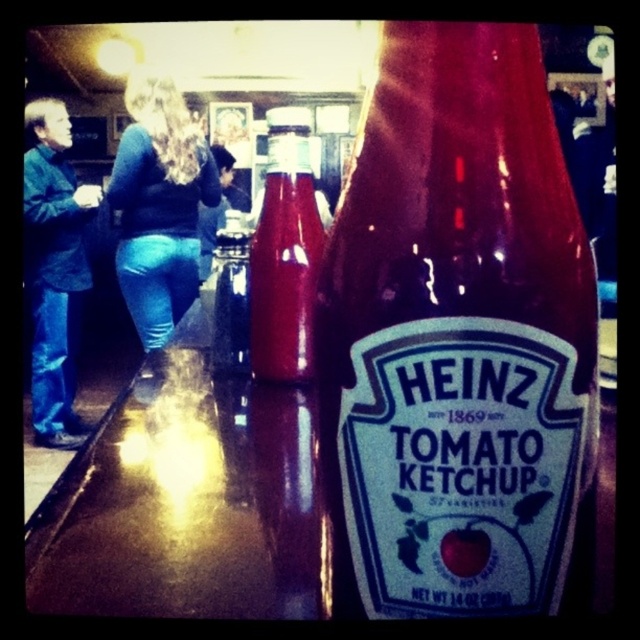
Who is taller, jeans at left or matte glass bottle at center?

jeans at left

The height and width of the screenshot is (640, 640). What do you see at coordinates (52, 269) in the screenshot? I see `jeans at left` at bounding box center [52, 269].

This screenshot has height=640, width=640. I want to click on jeans at left, so click(52, 269).

Is point (33, 253) more distant than point (202, 212)?

No, (33, 253) is closer to viewer.

Looking at this image, between jeans at left and blue jeans at lower left, which one is positioned higher?

blue jeans at lower left is higher up.

Is point (51, 161) less distant than point (196, 228)?

Yes, it is.

I want to click on jeans at left, so click(x=52, y=269).

Can you confirm if translucent glass bottle at center is wider than blue jeans at lower left?

Incorrect, translucent glass bottle at center's width does not surpass blue jeans at lower left's.

Does translucent glass bottle at center have a larger size compared to blue jeans at lower left?

No, translucent glass bottle at center is not bigger than blue jeans at lower left.

Is point (548, 141) behind point (211, 236)?

No.

You are a GUI agent. You are given a task and a screenshot of the screen. Output one action in this format:
    pyautogui.click(x=<x>, y=<y>)
    Task: Click on the translucent glass bottle at center
    
    Given the screenshot: What is the action you would take?
    pyautogui.click(x=456, y=337)